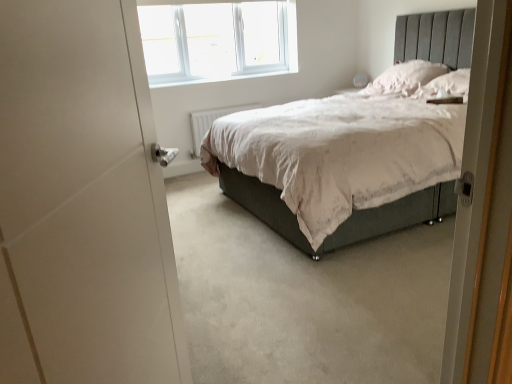
Question: Is pink fabric pillow at upper right, which is counted as the second pillow, starting from the front, further to the viewer compared to white matte door at left?

Choices:
 (A) yes
 (B) no

Answer: (A)

Question: Is pink fabric pillow at upper right, which is the 1th pillow in back-to-front order, smaller than white matte door at left?

Choices:
 (A) yes
 (B) no

Answer: (A)

Question: Does pink fabric pillow at upper right, which is the 1th pillow in back-to-front order, touch white matte door at left?

Choices:
 (A) yes
 (B) no

Answer: (B)

Question: From a real-world perspective, is pink fabric pillow at upper right, which is counted as the second pillow, starting from the front, over white matte door at left?

Choices:
 (A) yes
 (B) no

Answer: (A)

Question: Is pink fabric pillow at upper right, which is counted as the second pillow, starting from the front, oriented away from white matte door at left?

Choices:
 (A) no
 (B) yes

Answer: (A)

Question: Is white soft pillow at upper right, marked as the 2th pillow in a back-to-front arrangement, inside or outside of white plastic window at upper center?

Choices:
 (A) outside
 (B) inside

Answer: (A)

Question: Considering the positions of white soft pillow at upper right, which is the first pillow in front-to-back order, and white plastic window at upper center in the image, is white soft pillow at upper right, which is the first pillow in front-to-back order, taller or shorter than white plastic window at upper center?

Choices:
 (A) short
 (B) tall

Answer: (A)

Question: From a real-world perspective, is white soft pillow at upper right, which is the first pillow in front-to-back order, positioned above or below white plastic window at upper center?

Choices:
 (A) above
 (B) below

Answer: (B)

Question: Is white soft pillow at upper right, marked as the 2th pillow in a back-to-front arrangement, bigger or smaller than white plastic window at upper center?

Choices:
 (A) big
 (B) small

Answer: (B)

Question: Is white matte door at left to the left or to the right of pink fabric pillow at upper right, which is counted as the second pillow, starting from the front, in the image?

Choices:
 (A) left
 (B) right

Answer: (A)

Question: In the image, is white matte door at left positioned in front of or behind pink fabric pillow at upper right, which is the 1th pillow in back-to-front order?

Choices:
 (A) behind
 (B) front

Answer: (B)

Question: Is white matte door at left wider or thinner than pink fabric pillow at upper right, which is the 1th pillow in back-to-front order?

Choices:
 (A) wide
 (B) thin

Answer: (B)

Question: Considering the positions of white matte door at left and pink fabric pillow at upper right, which is counted as the second pillow, starting from the front, in the image, is white matte door at left bigger or smaller than pink fabric pillow at upper right, which is counted as the second pillow, starting from the front,?

Choices:
 (A) small
 (B) big

Answer: (B)

Question: Is point (243, 109) closer or farther from the camera than point (225, 16)?

Choices:
 (A) farther
 (B) closer

Answer: (B)

Question: Is white plastic radiator at center inside or outside of white plastic window at upper center?

Choices:
 (A) inside
 (B) outside

Answer: (B)